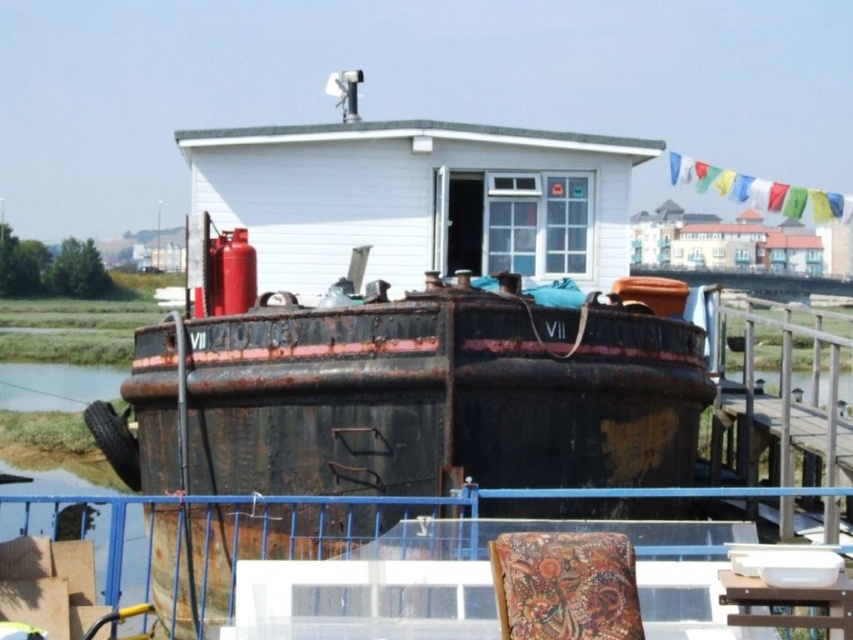
Question: Which point is farther from the camera taking this photo?

Choices:
 (A) (845, 604)
 (B) (625, 577)

Answer: (B)

Question: Among these points, which one is farthest from the camera?

Choices:
 (A) (778, 596)
 (B) (625, 584)

Answer: (B)

Question: Among these points, which one is farthest from the camera?

Choices:
 (A) (503, 557)
 (B) (740, 580)

Answer: (B)

Question: Does patterned fabric chair at lower center have a lesser width compared to wooden table at lower right?

Choices:
 (A) no
 (B) yes

Answer: (A)

Question: Can you confirm if patterned fabric chair at lower center is positioned above wooden table at lower right?

Choices:
 (A) no
 (B) yes

Answer: (B)

Question: Is patterned fabric chair at lower center above wooden table at lower right?

Choices:
 (A) yes
 (B) no

Answer: (A)